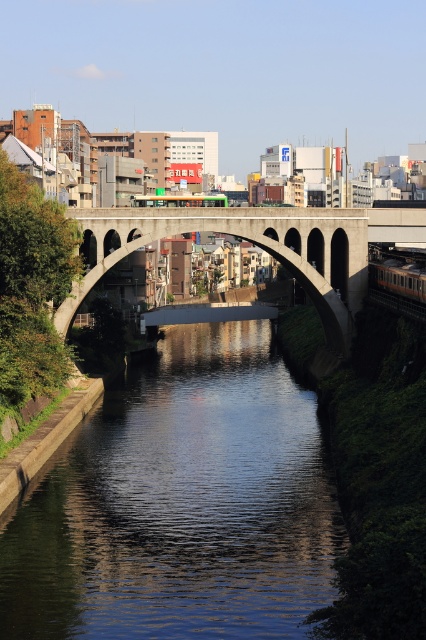
Locate an element on the screen. The height and width of the screenshot is (640, 426). smooth concrete river at center is located at coordinates 180,504.

Consider the image. Is smooth concrete river at center wider than metallic silver train at center?

Correct, the width of smooth concrete river at center exceeds that of metallic silver train at center.

Which is behind, point (192, 538) or point (417, 268)?

The point (417, 268) is more distant.

Where is `smooth concrete river at center`? This screenshot has width=426, height=640. smooth concrete river at center is located at coordinates (180, 504).

Is concrete bridge at center wider than metallic silver train at center?

Yes.

Does concrete bridge at center have a smaller size compared to metallic silver train at center?

Incorrect, concrete bridge at center is not smaller in size than metallic silver train at center.

Between point (249, 214) and point (394, 264), which one is positioned in front?

Point (249, 214)

The image size is (426, 640). Identify the location of concrete bridge at center. (247, 240).

Which is behind, point (78, 520) or point (362, 243)?

Positioned behind is point (362, 243).

Is smooth concrete river at center positioned at the back of concrete bridge at center?

No, it is not.

Locate an element on the screen. This screenshot has height=640, width=426. smooth concrete river at center is located at coordinates (180, 504).